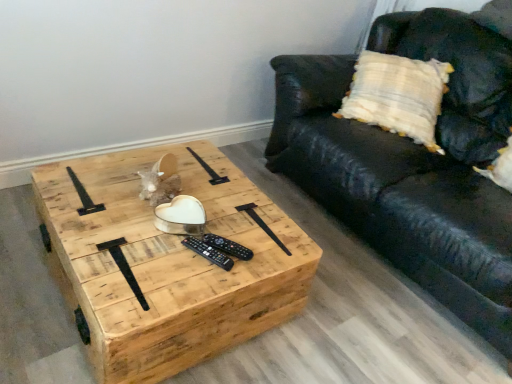
Where is `vacant location behind black plastic remote at center, the 2th remote when ordered from front to back`? vacant location behind black plastic remote at center, the 2th remote when ordered from front to back is located at coordinates (233, 216).